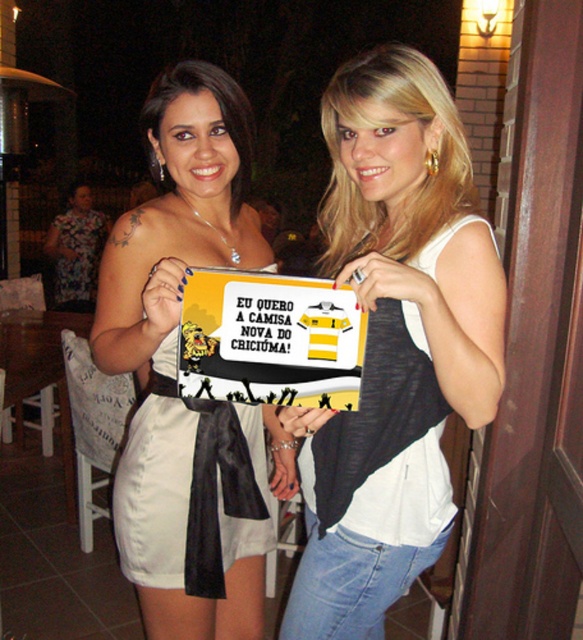
Question: Among these objects, which one is farthest from the camera?

Choices:
 (A) yellow/yellow and white striped jersey at center
 (B) black leather dress at center
 (C) white satin dress at center
 (D) yellow and black jersey at center

Answer: (C)

Question: Does matte white dress at center have a smaller size compared to black leather dress at center?

Choices:
 (A) no
 (B) yes

Answer: (A)

Question: Where is white satin dress at center located in relation to black leather dress at center in the image?

Choices:
 (A) left
 (B) right

Answer: (A)

Question: Among these points, which one is farthest from the camera?

Choices:
 (A) (468, 216)
 (B) (378, 301)
 (C) (231, 428)

Answer: (C)

Question: Does black leather dress at center lie in front of yellow/yellow and white striped jersey at center?

Choices:
 (A) no
 (B) yes

Answer: (B)

Question: Which object appears farthest from the camera in this image?

Choices:
 (A) white satin dress at center
 (B) floral fabric dress at left
 (C) matte white dress at center
 (D) black leather dress at center

Answer: (B)